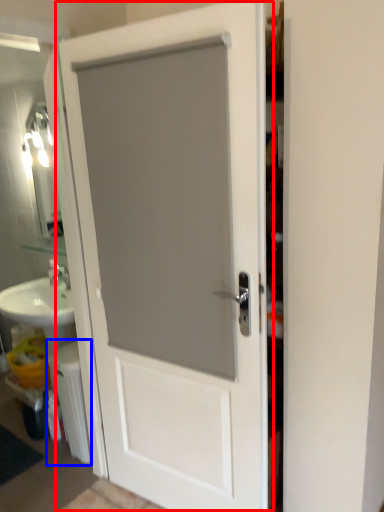
Question: Among these objects, which one is nearest to the camera, door (highlighted by a red box) or radiator (highlighted by a blue box)?

Choices:
 (A) door
 (B) radiator

Answer: (A)